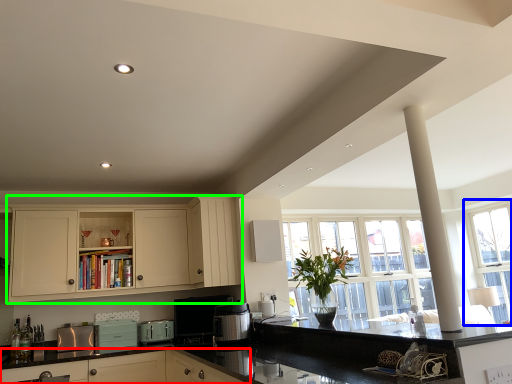
Question: Considering the real-world distances, which object is farthest from cabinetry (highlighted by a red box)? window (highlighted by a blue box) or cabinetry (highlighted by a green box)?

Choices:
 (A) window
 (B) cabinetry

Answer: (A)